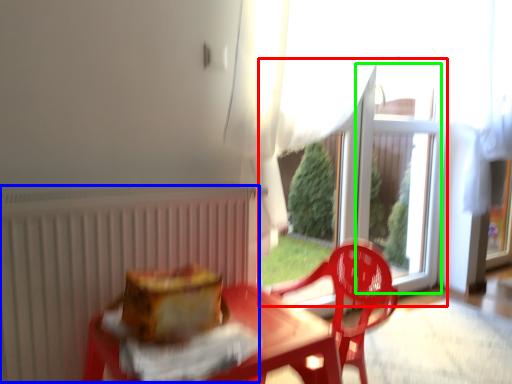
Question: Which is farther away from glass door (highlighted by a red box)? radiator (highlighted by a blue box) or window screen (highlighted by a green box)?

Choices:
 (A) radiator
 (B) window screen

Answer: (A)